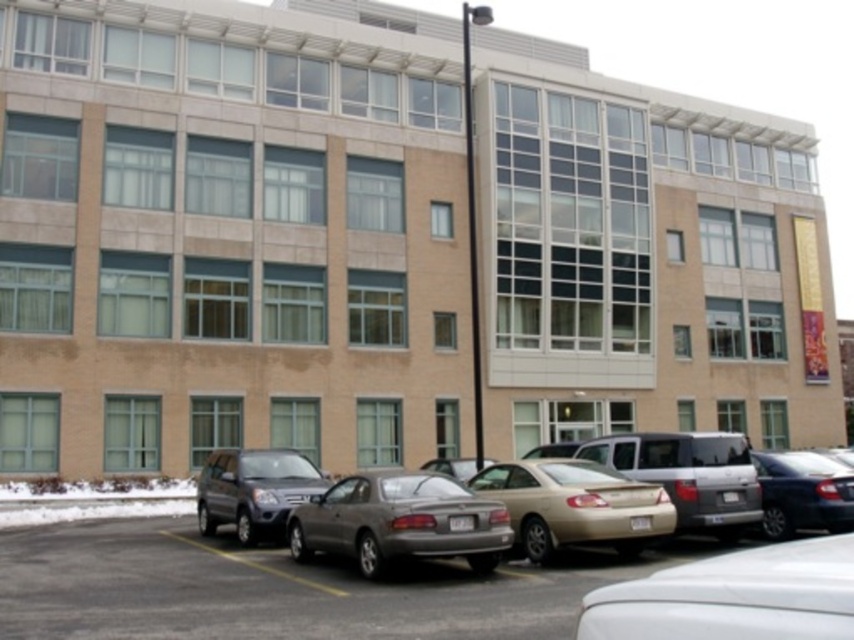
Question: Considering the relative positions of metallic silver car at center and satin gray sedan at center in the image provided, where is metallic silver car at center located with respect to satin gray sedan at center?

Choices:
 (A) left
 (B) right

Answer: (A)

Question: Is metallic silver car at center bigger than silver metallic suv at lower right?

Choices:
 (A) no
 (B) yes

Answer: (A)

Question: Which object appears closest to the camera in this image?

Choices:
 (A) white matte sedan at lower right
 (B) metallic silver car at center
 (C) metallic gray suv at lower left

Answer: (A)

Question: Among these objects, which one is farthest from the camera?

Choices:
 (A) shiny dark blue sedan at right
 (B) satin gray sedan at center
 (C) silver metallic suv at lower right

Answer: (A)

Question: Which object is closer to the camera taking this photo?

Choices:
 (A) silver metallic suv at lower right
 (B) gold metallic sedan at center
 (C) metallic gray suv at lower left

Answer: (B)

Question: Can you confirm if satin gray sedan at center is thinner than gold metallic sedan at center?

Choices:
 (A) yes
 (B) no

Answer: (B)